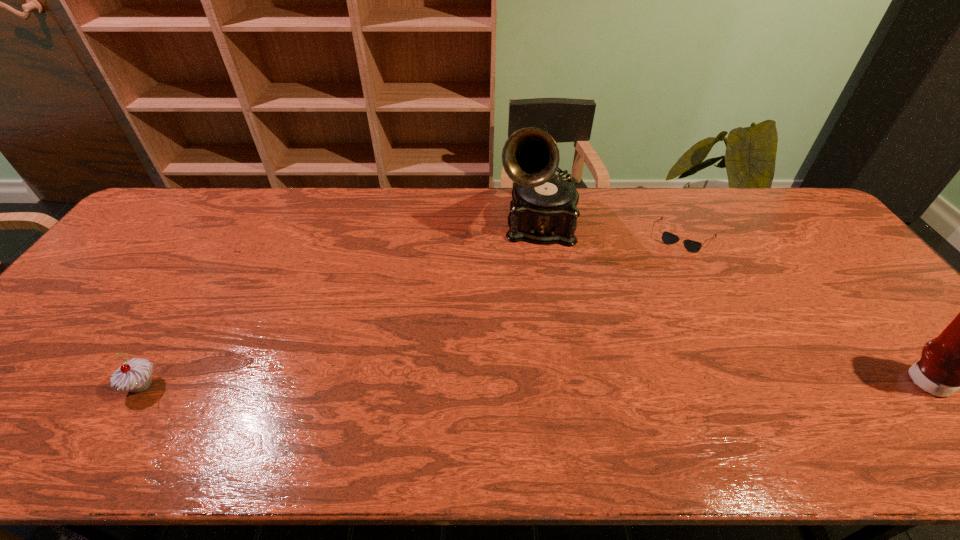
Identify which object is the second nearest to the second object from right to left. Please provide its 2D coordinates. Your answer should be formatted as a tuple, i.e. [(x, y)], where the tuple contains the x and y coordinates of a point satisfying the conditions above.

[(959, 358)]

Select which object appears as the closest to the tallest object. Please provide its 2D coordinates. Your answer should be formatted as a tuple, i.e. [(x, y)], where the tuple contains the x and y coordinates of a point satisfying the conditions above.

[(668, 238)]